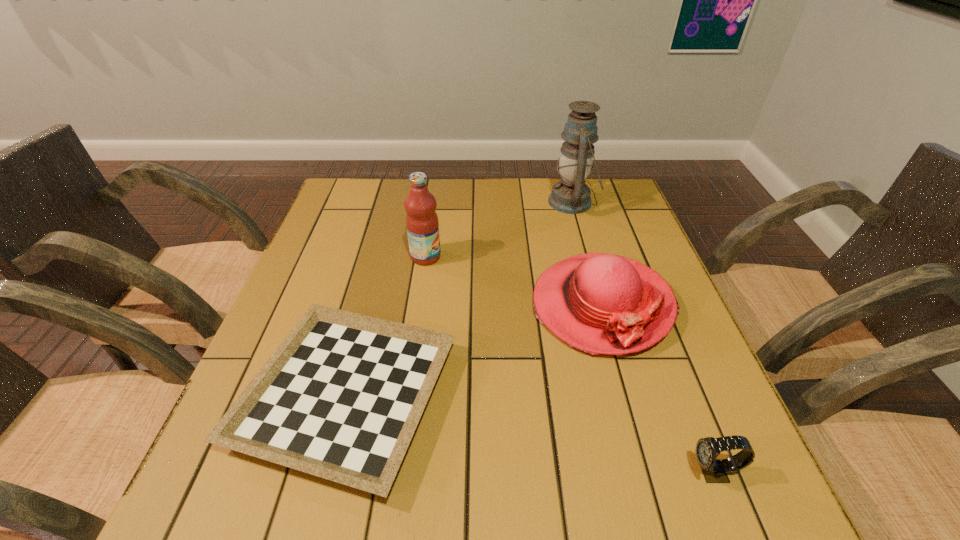
At what (x,y) coordinates should I click in order to perform the action: click on unoccupied area between the fruit juice and the watch. Please return your answer as a coordinate pair (x, y). The height and width of the screenshot is (540, 960). Looking at the image, I should click on (569, 364).

Identify the location of free spot between the farthest object and the second tallest object. (499, 230).

This screenshot has height=540, width=960. I want to click on free area in between the checkerboard and the watch, so click(530, 434).

Locate an element on the screen. The image size is (960, 540). object that stands as the third closest to the checkerboard is located at coordinates (714, 470).

This screenshot has width=960, height=540. In order to click on object that is the second closest to the fourth shortest object in this screenshot , I will do `click(599, 303)`.

Where is `vacant space that satisfies the following two spatial constraints: 1. on the back side of the shortest object; 2. on the right side of the farthest object`? The height and width of the screenshot is (540, 960). vacant space that satisfies the following two spatial constraints: 1. on the back side of the shortest object; 2. on the right side of the farthest object is located at coordinates (397, 202).